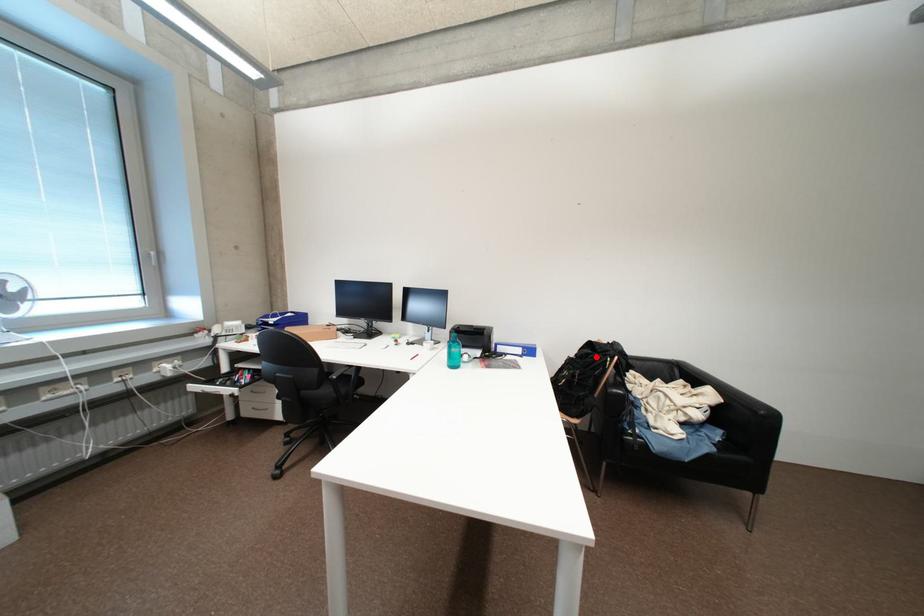
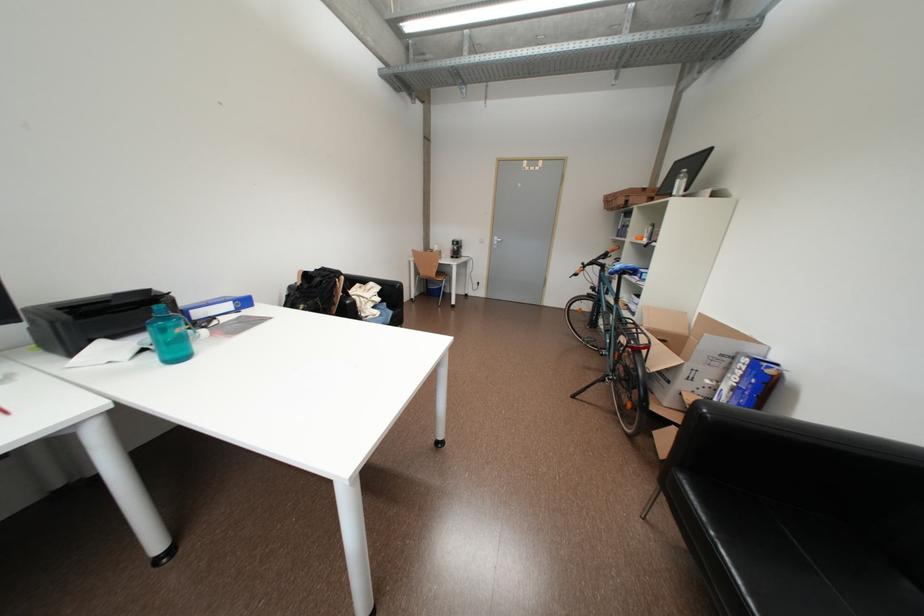
Question: I am providing you with two images of the same scene from different viewpoints. A red point is shown in image1. For the corresponding object point in image2, is it positioned nearer or farther from the camera?

Choices:
 (A) Nearer
 (B) Farther

Answer: (A)